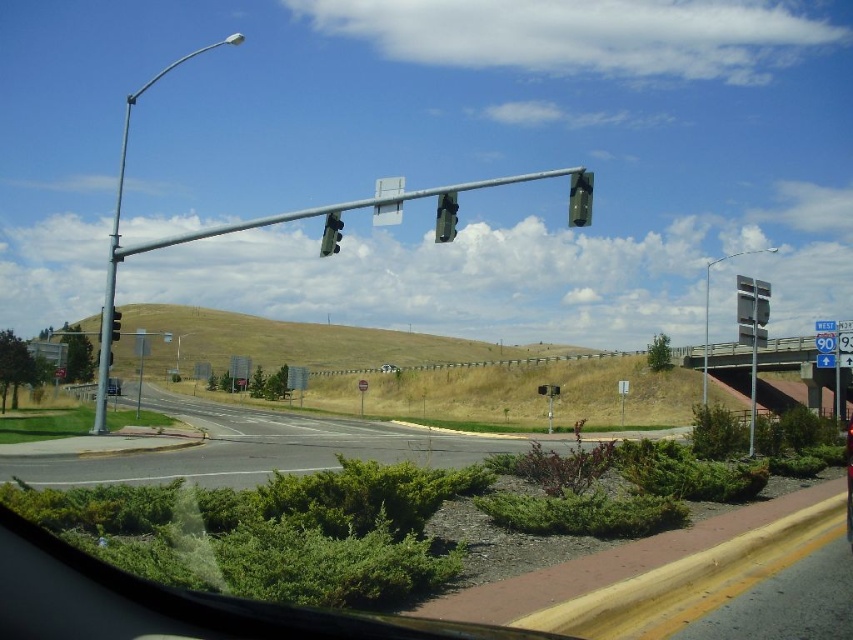
You are standing at the intersection and want to walk from the traffic light pole to the sidewalk. Which point, point (210, 48) or point (741, 300), is closer to you?

Point (210, 48) is closer to you because it is further to the viewer than point (741, 300).

You are standing at the intersection and want to cross the road. There is a metallic green traffic light at upper center. Where is the metallic green traffic light at upper center located relative to the point marked by coordinates point (579,198)?

The metallic green traffic light at upper center is located exactly at the point marked by coordinates point (579,198).

You are a pedestrian standing at the intersection and want to cross the road. You see the metallic green traffic light at upper center and the matte black traffic light at center. Which traffic light is closer to you?

The metallic green traffic light at upper center is closer to you because it is in front of the matte black traffic light at center.